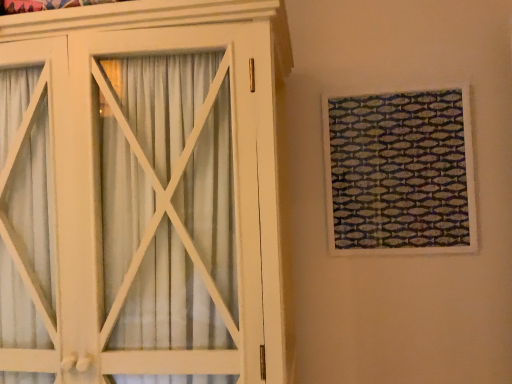
Question: Choose the correct answer: Is textured fabric at upper right inside white wood cupboard at left or outside it?

Choices:
 (A) outside
 (B) inside

Answer: (A)

Question: From a real-world perspective, is textured fabric at upper right physically located above or below white wood cupboard at left?

Choices:
 (A) below
 (B) above

Answer: (B)

Question: From the image's perspective, is textured fabric at upper right positioned above or below white wood cupboard at left?

Choices:
 (A) below
 (B) above

Answer: (B)

Question: Looking at their shapes, would you say white wood cupboard at left is wider or thinner than textured fabric at upper right?

Choices:
 (A) thin
 (B) wide

Answer: (B)

Question: From a real-world perspective, relative to textured fabric at upper right, is white wood cupboard at left vertically above or below?

Choices:
 (A) below
 (B) above

Answer: (A)

Question: Would you say white wood cupboard at left is inside or outside textured fabric at upper right?

Choices:
 (A) inside
 (B) outside

Answer: (B)

Question: Visually, is white wood cupboard at left positioned to the left or to the right of textured fabric at upper right?

Choices:
 (A) left
 (B) right

Answer: (A)